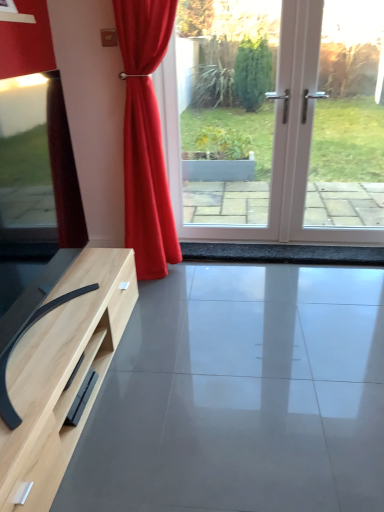
What do you see at coordinates (146, 136) in the screenshot?
I see `satin red curtain at center` at bounding box center [146, 136].

Locate an element on the screen. The width and height of the screenshot is (384, 512). matte wood tv stand at lower left is located at coordinates (241, 396).

Is matte wood tv stand at lower left inside the boundaries of satin red curtain at center, or outside?

matte wood tv stand at lower left is spatially situated outside satin red curtain at center.

Does matte wood tv stand at lower left turn towards satin red curtain at center?

No, matte wood tv stand at lower left is not turned towards satin red curtain at center.

Does matte wood tv stand at lower left have a lesser width compared to satin red curtain at center?

In fact, matte wood tv stand at lower left might be wider than satin red curtain at center.

Considering the sizes of objects satin red curtain at center and matte wood tv stand at lower left in the image provided, who is thinner, satin red curtain at center or matte wood tv stand at lower left?

satin red curtain at center is thinner.

How much distance is there between satin red curtain at center and matte wood tv stand at lower left?

They are 1.06 meters apart.

Considering the points (163, 26) and (148, 382), which point is in front, point (163, 26) or point (148, 382)?

The point (148, 382) is closer.

Is the depth of satin red curtain at center less than that of matte wood tv stand at lower left?

No, it is behind matte wood tv stand at lower left.

From the image's perspective, between matte wood tv stand at lower left and white glossy screen door at center, who is located below?

From the image's view, matte wood tv stand at lower left is below.

From a real-world perspective, which object stands above the other?

From a 3D spatial view, white glossy screen door at center is above.

Which of these two, matte wood tv stand at lower left or white glossy screen door at center, is smaller?

matte wood tv stand at lower left.

How much distance is there between white glossy screen door at center and satin red curtain at center?

white glossy screen door at center and satin red curtain at center are 7.41 feet apart from each other.

Could satin red curtain at center be considered to be inside white glossy screen door at center?

That's incorrect, satin red curtain at center is not inside white glossy screen door at center.

Between point (226, 1) and point (155, 105), which one is positioned behind?

Point (226, 1)

From the image's perspective, is white glossy screen door at center on top of satin red curtain at center?

Indeed, from the image's perspective, white glossy screen door at center is shown above satin red curtain at center.

From the picture: How far apart are satin red curtain at center and white glossy screen door at center?

The distance of satin red curtain at center from white glossy screen door at center is 7.41 feet.

In the scene shown: Does satin red curtain at center turn towards white glossy screen door at center?

No, satin red curtain at center is not turned towards white glossy screen door at center.

Does point (148, 259) come farther from viewer compared to point (305, 12)?

Yes, point (148, 259) is farther from viewer.

Is satin red curtain at center bigger or smaller than white glossy screen door at center?

In the image, satin red curtain at center appears to be smaller than white glossy screen door at center.

Does white glossy screen door at center have a greater height compared to matte wood tv stand at lower left?

Correct, white glossy screen door at center is much taller as matte wood tv stand at lower left.

Which is in front, white glossy screen door at center or matte wood tv stand at lower left?

matte wood tv stand at lower left is more forward.

Does point (313, 0) come closer to viewer compared to point (365, 441)?

No, it is not.

Where is `curtain behind the matte wood tv stand at lower left`? curtain behind the matte wood tv stand at lower left is located at coordinates (146, 136).

You are a GUI agent. You are given a task and a screenshot of the screen. Output one action in this format:
    pyautogui.click(x=<x>, y=<y>)
    Task: Click on the curtain above the matte wood tv stand at lower left (from a real-world perspective)
    The width and height of the screenshot is (384, 512).
    Given the screenshot: What is the action you would take?
    pyautogui.click(x=146, y=136)

Based on their spatial positions, is matte wood tv stand at lower left or satin red curtain at center further from white glossy screen door at center?

matte wood tv stand at lower left lies further to white glossy screen door at center than the other object.

Considering their positions, is white glossy screen door at center positioned closer to matte wood tv stand at lower left than satin red curtain at center?

satin red curtain at center lies closer to matte wood tv stand at lower left than the other object.

Considering their positions, is satin red curtain at center positioned further to white glossy screen door at center than matte wood tv stand at lower left?

Based on the image, matte wood tv stand at lower left appears to be further to white glossy screen door at center.

From the image, which object appears to be nearer to satin red curtain at center, matte wood tv stand at lower left or white glossy screen door at center?

The object closer to satin red curtain at center is matte wood tv stand at lower left.

Considering their positions, is satin red curtain at center positioned further to matte wood tv stand at lower left than white glossy screen door at center?

The object further to matte wood tv stand at lower left is white glossy screen door at center.

When comparing their distances from satin red curtain at center, does white glossy screen door at center or matte wood tv stand at lower left seem further?

Based on the image, white glossy screen door at center appears to be further to satin red curtain at center.

Identify the location of curtain between white glossy screen door at center and matte wood tv stand at lower left in the up-down direction. This screenshot has width=384, height=512. (146, 136).